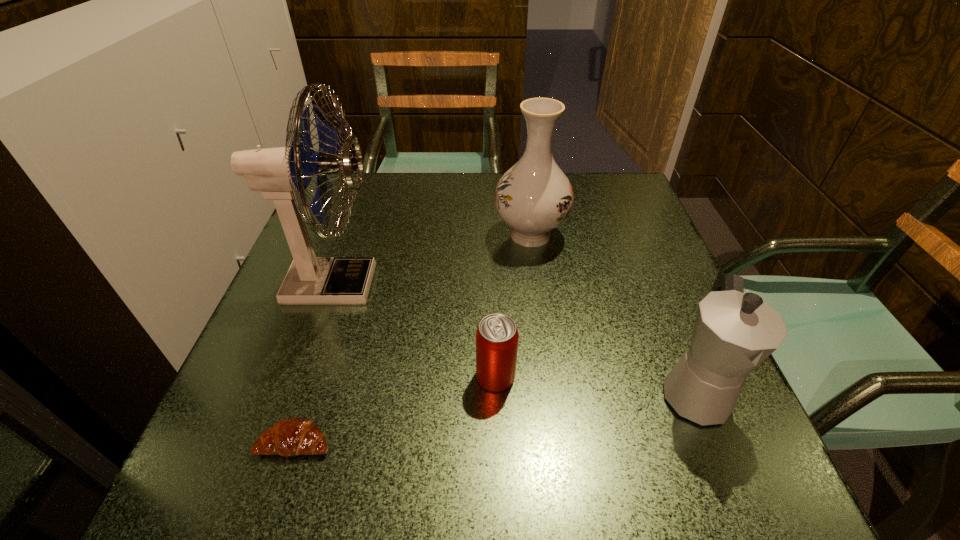
Image resolution: width=960 pixels, height=540 pixels. Find the location of `fan`. fan is located at coordinates (279, 173).

Locate an element on the screen. This screenshot has height=540, width=960. the fourth shortest object is located at coordinates (533, 197).

Image resolution: width=960 pixels, height=540 pixels. Identify the location of the third shortest object. (734, 332).

The height and width of the screenshot is (540, 960). I want to click on coffeepot, so click(x=734, y=332).

The width and height of the screenshot is (960, 540). In order to click on can in this screenshot , I will do `click(497, 336)`.

Identify the location of crescent roll. [294, 436].

Locate an element on the screen. vacant position located 0.360m on the front-facing side of the fan is located at coordinates (554, 284).

Where is `blank space located on the left of the second tallest object`? The height and width of the screenshot is (540, 960). blank space located on the left of the second tallest object is located at coordinates (401, 235).

The image size is (960, 540). Find the location of `vacant space located on the left of the coffeepot`. vacant space located on the left of the coffeepot is located at coordinates (450, 392).

Image resolution: width=960 pixels, height=540 pixels. In order to click on free spot located on the left of the fourth tallest object in this screenshot , I will do `click(395, 376)`.